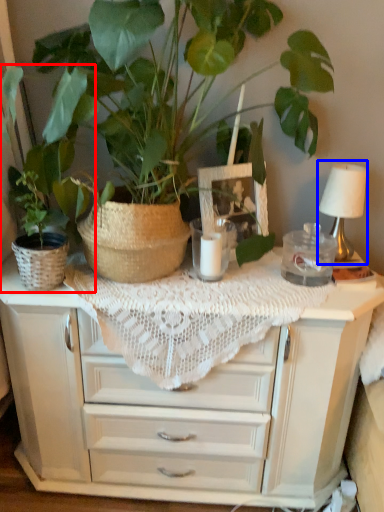
Question: Which point is closer to the camera, houseplant (highlighted by a red box) or table lamp (highlighted by a blue box)?

Choices:
 (A) houseplant
 (B) table lamp

Answer: (A)